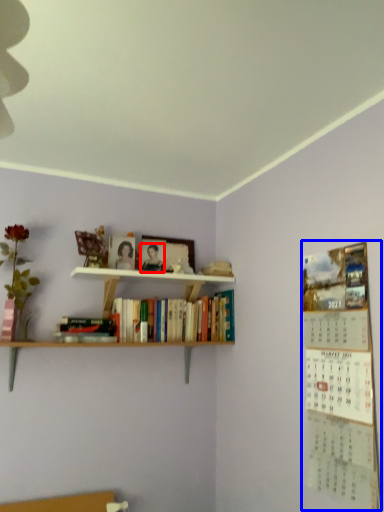
Question: Which object appears farthest to the camera in this image, person (highlighted by a red box) or bulletin board (highlighted by a blue box)?

Choices:
 (A) person
 (B) bulletin board

Answer: (A)